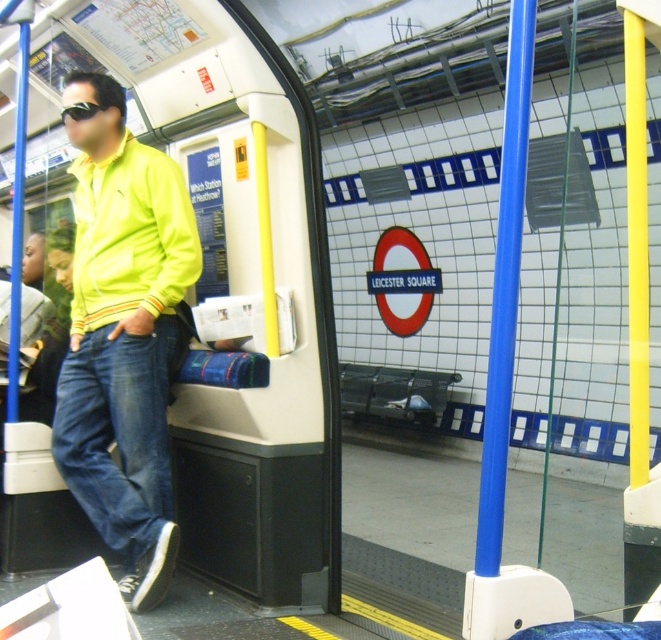
Question: Which object appears closest to the camera in this image?

Choices:
 (A) denim at left
 (B) neon yellow fabric jacket at left
 (C) neon yellow jacket at left
 (D) black rubber goggles at upper left

Answer: (C)

Question: Is denim at left bigger than neon yellow fabric jacket at left?

Choices:
 (A) no
 (B) yes

Answer: (A)

Question: Observing the image, what is the correct spatial positioning of neon yellow jacket at left in reference to denim at left?

Choices:
 (A) left
 (B) right

Answer: (B)

Question: Estimate the real-world distances between objects in this image. Which object is farther from the denim at left?

Choices:
 (A) black rubber goggles at upper left
 (B) neon yellow fabric jacket at left
 (C) neon yellow jacket at left

Answer: (A)

Question: Which of the following is the farthest from the observer?

Choices:
 (A) (67, 467)
 (B) (87, 344)
 (C) (75, 272)
 (D) (73, 120)

Answer: (C)

Question: Does neon yellow jacket at left appear on the right side of black rubber goggles at upper left?

Choices:
 (A) no
 (B) yes

Answer: (B)